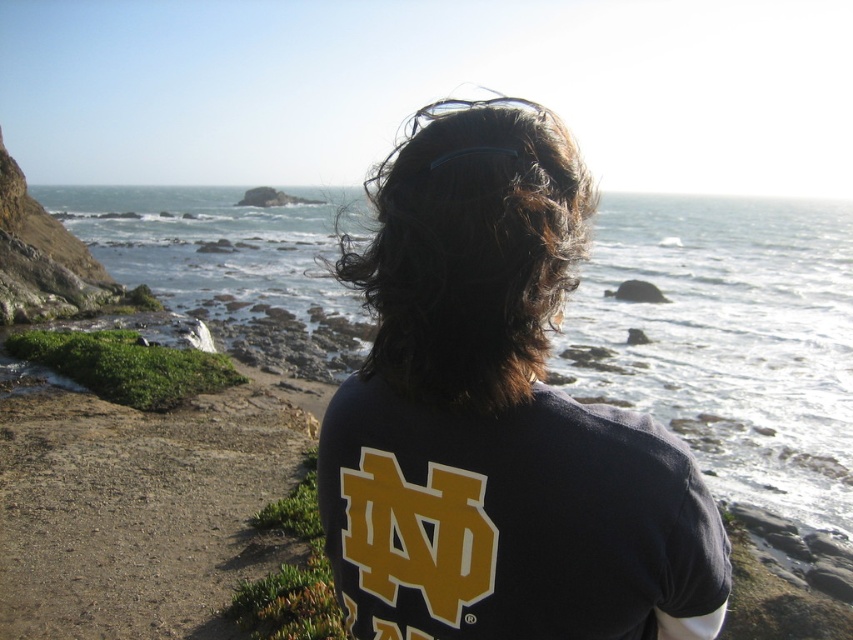
Question: Is dark blue t-shirt at center below dark blue jersey at center?

Choices:
 (A) yes
 (B) no

Answer: (B)

Question: Among these points, which one is farthest from the camera?

Choices:
 (A) [184, 285]
 (B) [465, 444]
 (C) [523, 289]

Answer: (A)

Question: Based on their relative distances, which object is farther from the dark blue jersey at center?

Choices:
 (A) dark brown curly hair at center
 (B) dark blue t-shirt at center
 (C) clear water at center

Answer: (C)

Question: Is dark blue jersey at center positioned at the back of dark brown curly hair at center?

Choices:
 (A) yes
 (B) no

Answer: (B)

Question: Estimate the real-world distances between objects in this image. Which object is farther from the clear water at center?

Choices:
 (A) dark blue jersey at center
 (B) dark blue t-shirt at center
 (C) dark brown curly hair at center

Answer: (B)

Question: Is clear water at center bigger than dark brown curly hair at center?

Choices:
 (A) yes
 (B) no

Answer: (A)